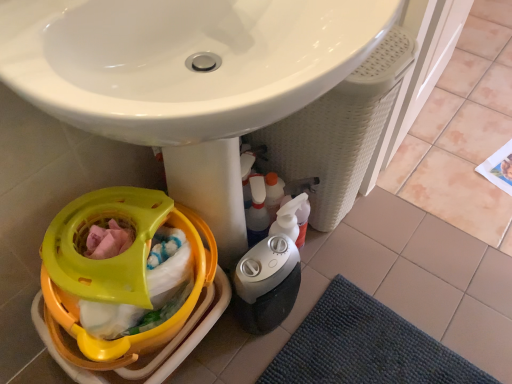
Question: From their relative heights in the image, would you say translucent plastic spray bottle at lower center is taller or shorter than yellow plastic baby carriage at lower left?

Choices:
 (A) tall
 (B) short

Answer: (A)

Question: Considering their positions, is translucent plastic spray bottle at lower center located in front of or behind yellow plastic baby carriage at lower left?

Choices:
 (A) front
 (B) behind

Answer: (B)

Question: Which of these objects is positioned farthest from the white glossy sink at center?

Choices:
 (A) translucent plastic spray bottle at lower center
 (B) beige tile at lower right
 (C) dark blue textured bath mat at lower right
 (D) gray plastic humidifier at lower center
 (E) yellow plastic baby carriage at lower left

Answer: (B)

Question: Estimate the real-world distances between objects in this image. Which object is farther from the dark blue textured bath mat at lower right?

Choices:
 (A) gray plastic humidifier at lower center
 (B) translucent plastic spray bottle at lower center
 (C) white glossy sink at center
 (D) yellow plastic baby carriage at lower left
 (E) beige tile at lower right

Answer: (E)